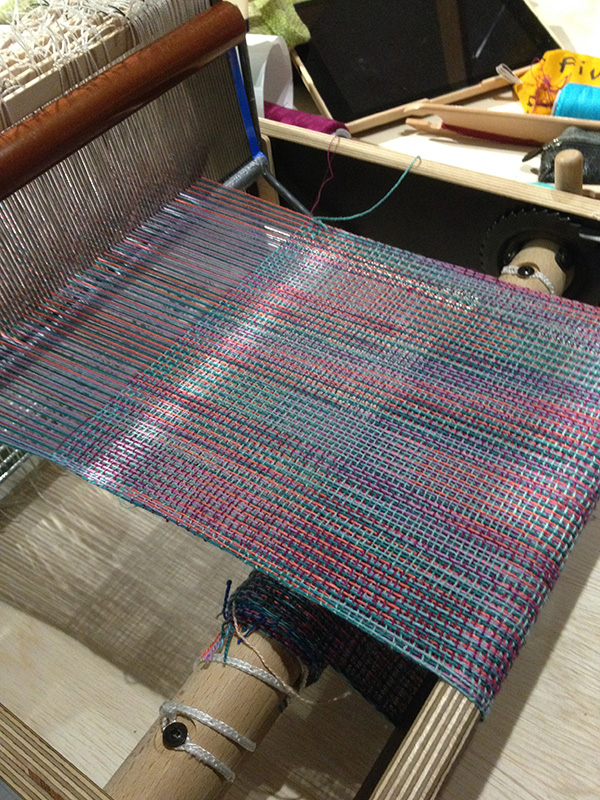
This screenshot has width=600, height=800. Find the location of `light brown wood surface`. light brown wood surface is located at coordinates (548, 741), (560, 688), (36, 649).